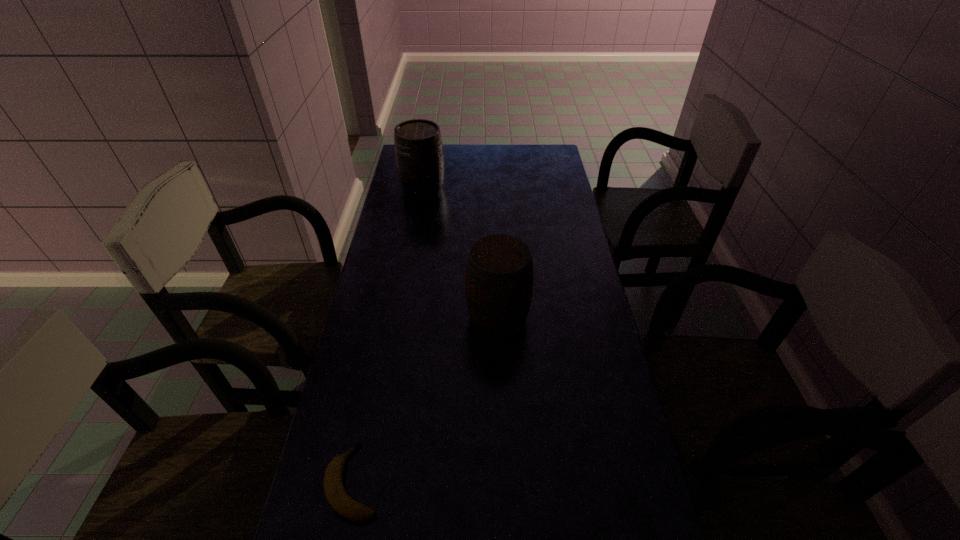
Where is `the farthest object`? This screenshot has height=540, width=960. the farthest object is located at coordinates (419, 154).

Locate an element on the screen. the left cider is located at coordinates (419, 154).

You are a GUI agent. You are given a task and a screenshot of the screen. Output one action in this format:
    pyautogui.click(x=<x>, y=<y>)
    Task: Click on the second farthest object
    This screenshot has width=960, height=540.
    Given the screenshot: What is the action you would take?
    pyautogui.click(x=499, y=273)

Where is `the right cider`? The image size is (960, 540). the right cider is located at coordinates (499, 273).

At what (x,y) coordinates should I click in order to perform the action: click on the nearest object. Please return your answer as a coordinate pair (x, y). Image resolution: width=960 pixels, height=540 pixels. Looking at the image, I should click on (336, 495).

This screenshot has height=540, width=960. I want to click on the shortest object, so click(336, 495).

Locate an element on the screen. Image resolution: width=960 pixels, height=540 pixels. free location located on the side of the left cider near the bung hole is located at coordinates (420, 209).

The image size is (960, 540). Find the location of `vacant space located 0.070m on the right of the second farthest object`. vacant space located 0.070m on the right of the second farthest object is located at coordinates coord(552,317).

Where is `vacant area situated 0.170m on the back of the shortest object`? The width and height of the screenshot is (960, 540). vacant area situated 0.170m on the back of the shortest object is located at coordinates (373, 382).

Find the location of `cider present at the left edge`. cider present at the left edge is located at coordinates [x=419, y=154].